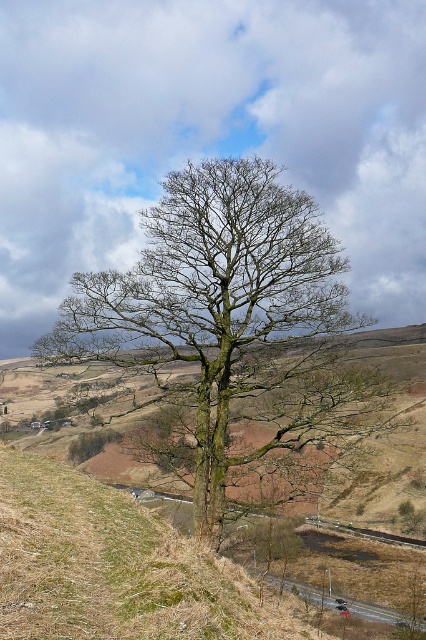
Question: Which of the following is the farthest from the observer?

Choices:
 (A) green mossy grass at center
 (B) green mossy tree at center

Answer: (B)

Question: Is green mossy tree at center to the left of green mossy grass at center from the viewer's perspective?

Choices:
 (A) no
 (B) yes

Answer: (A)

Question: Can you confirm if green mossy tree at center is positioned to the left of green mossy grass at center?

Choices:
 (A) no
 (B) yes

Answer: (A)

Question: Can you confirm if green mossy tree at center is thinner than green mossy grass at center?

Choices:
 (A) yes
 (B) no

Answer: (B)